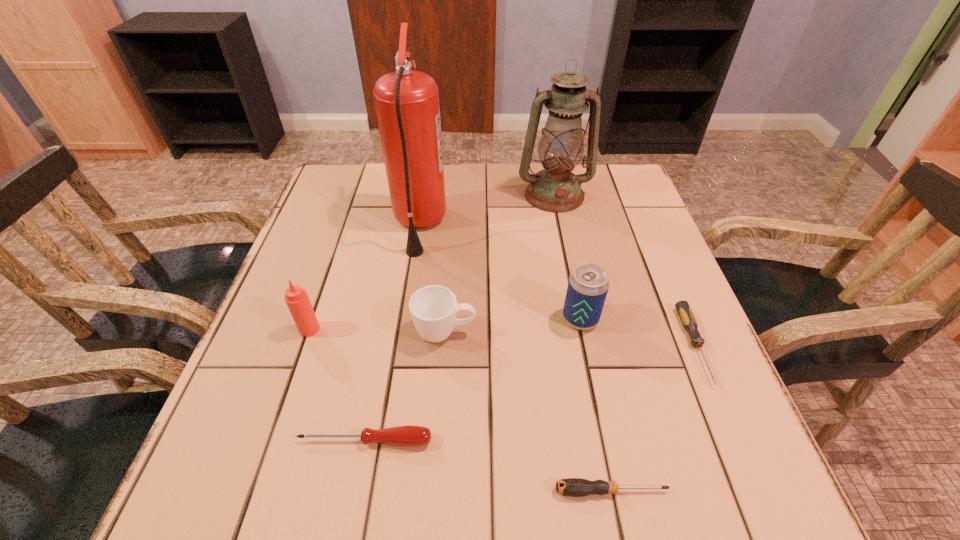
Identify the location of free location that satisfies the following two spatial constraints: 1. with the handle on the side of the cup; 2. on the back side of the nearest screwdriver. (434, 491).